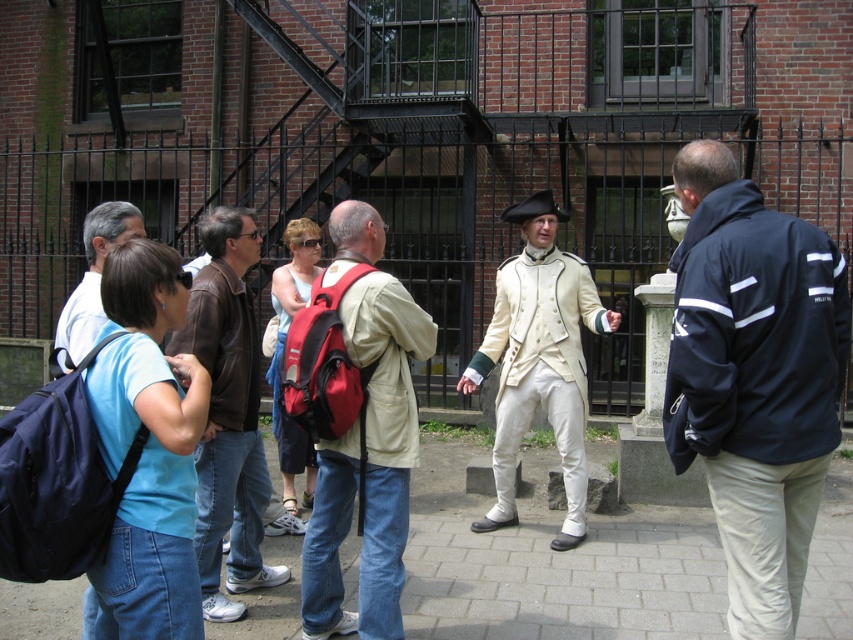
Between matte beige coat at center and brown leather jacket at left, which one appears on the right side from the viewer's perspective?

From the viewer's perspective, matte beige coat at center appears more on the right side.

Does matte beige coat at center appear under brown leather jacket at left?

Incorrect, matte beige coat at center is not positioned below brown leather jacket at left.

At what (x,y) coordinates should I click in order to perform the action: click on matte beige coat at center. Please return your answer as a coordinate pair (x, y). The height and width of the screenshot is (640, 853). Looking at the image, I should click on (366, 440).

Find the location of a particular element. The width and height of the screenshot is (853, 640). matte beige coat at center is located at coordinates (366, 440).

Is point (802, 560) positioned behind point (374, 221)?

No.

Which is more to the left, navy blue jacket at center or matte beige coat at center?

matte beige coat at center

Who is more forward, [752,456] or [380,403]?

Point [752,456] is more forward.

Locate an element on the screen. The width and height of the screenshot is (853, 640). navy blue jacket at center is located at coordinates (753, 378).

Is point (784, 252) positioned behind point (256, 244)?

No, it is in front of (256, 244).

Identify the location of navy blue jacket at center. The image size is (853, 640). (753, 378).